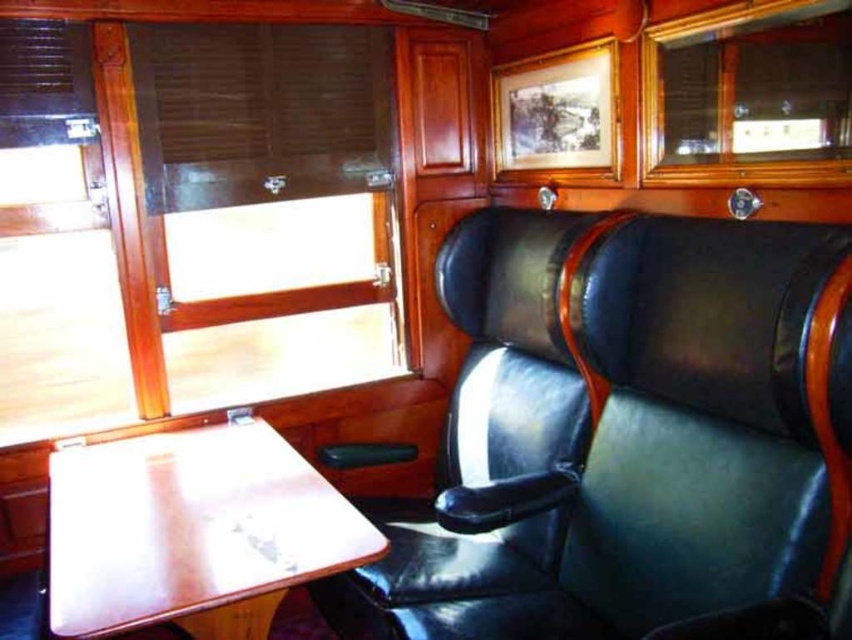
You are a passenger in the vintage train car and need to place a small luggage bag. You have two options for storage space available between the wooden panel at upper left and the black leather chair at center. Which storage space is smaller and more suitable for the small luggage bag?

The wooden panel at upper left occupies less space than the black leather chair at center, so the wooden panel at upper left is the smaller storage space and more suitable for the small luggage bag.

You are sitting in the vintage train car and want to place a small tray on the black leather chair at center. Based on its position, is the chair more towards the front or the back of the compartment?

The black leather chair at center is located at point coordinates suggesting it is positioned more towards the front of the compartment.